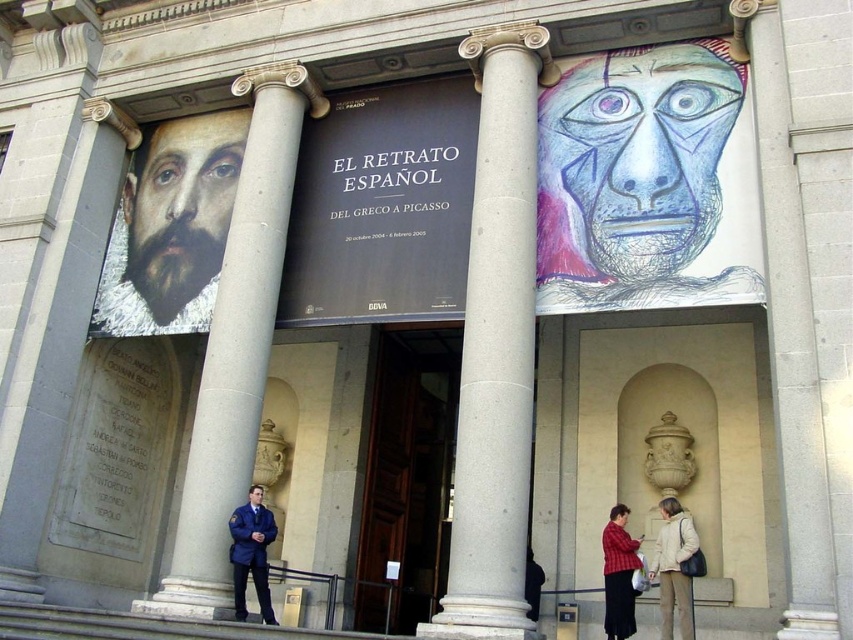
Question: Can you confirm if gray stone column at center is positioned above white cotton coat at lower right?

Choices:
 (A) no
 (B) yes

Answer: (B)

Question: Among these objects, which one is nearest to the camera?

Choices:
 (A) smooth stone column at center
 (B) blue uniform at center
 (C) black paper at center
 (D) red plaid shirt at lower right

Answer: (A)

Question: Which of the following is the closest to the observer?

Choices:
 (A) (604, 90)
 (B) (241, 589)

Answer: (B)

Question: Does blue sketchy face at upper right appear on the right side of matte black portrait at left?

Choices:
 (A) no
 (B) yes

Answer: (B)

Question: Which of the following is the farthest from the observer?

Choices:
 (A) (440, 534)
 (B) (614, 516)

Answer: (A)

Question: Can you confirm if white cotton coat at lower right is positioned above red plaid shirt at lower right?

Choices:
 (A) yes
 (B) no

Answer: (B)